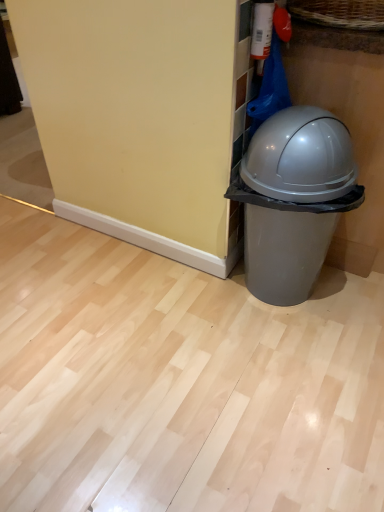
This screenshot has height=512, width=384. What are the coordinates of `free space in front of gray matte plastic trash can at right` in the screenshot? It's located at (294, 359).